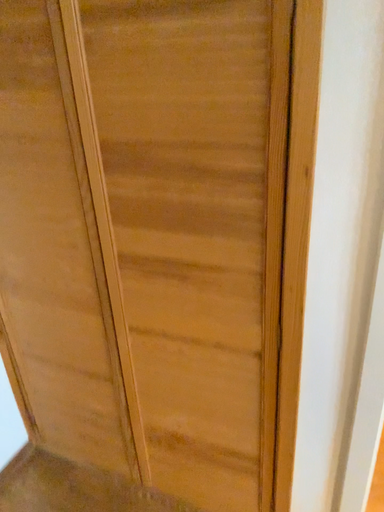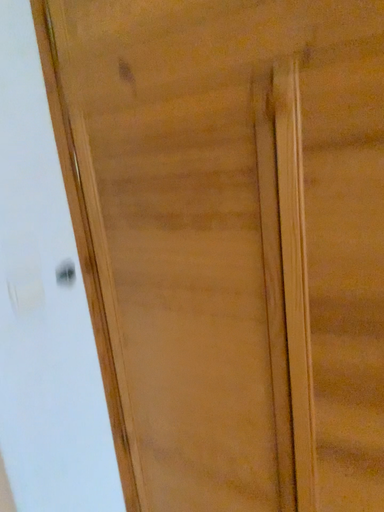
Question: How did the camera likely rotate when shooting the video?

Choices:
 (A) rotated right
 (B) rotated left

Answer: (B)